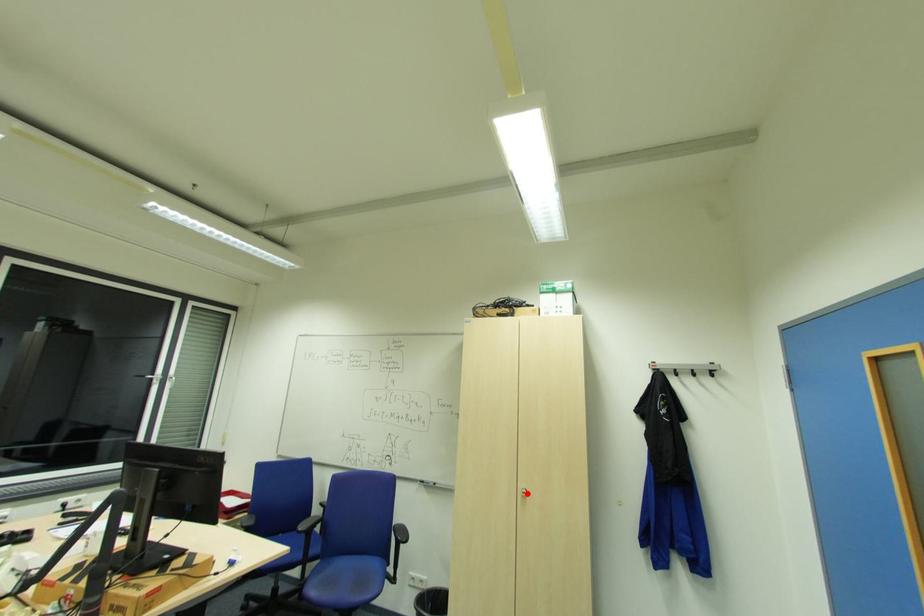
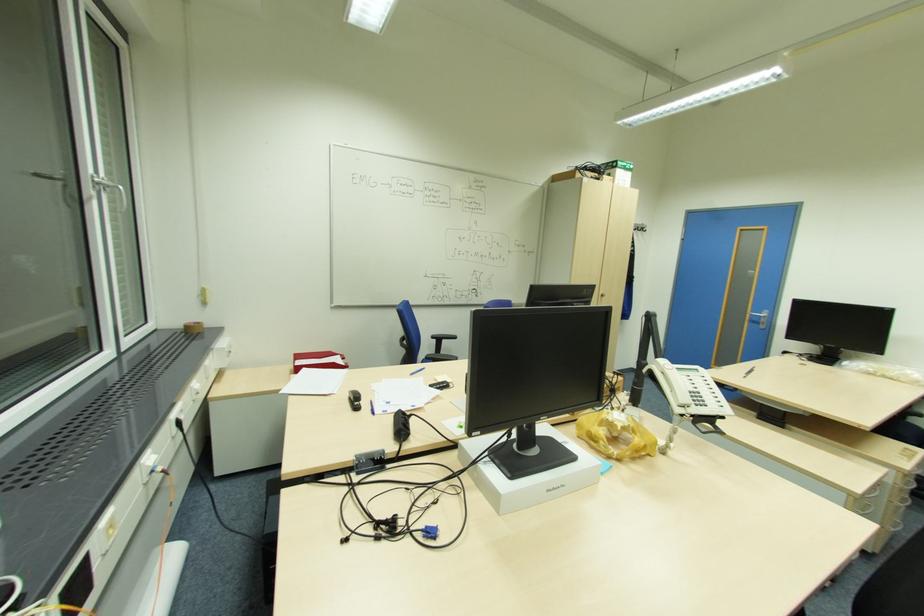
In the second image, find the point that corresponds to the highlighted location in the first image.

(604, 294)